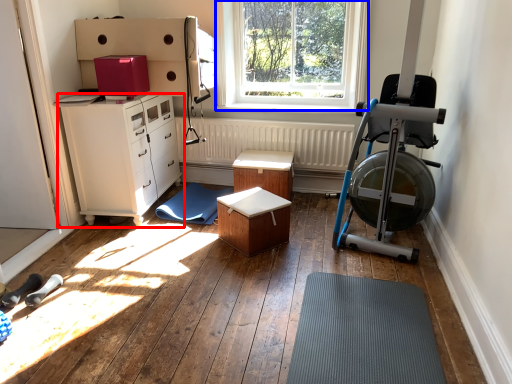
Question: Which object appears farthest to the camera in this image, chest of drawers (highlighted by a red box) or window (highlighted by a blue box)?

Choices:
 (A) chest of drawers
 (B) window

Answer: (B)